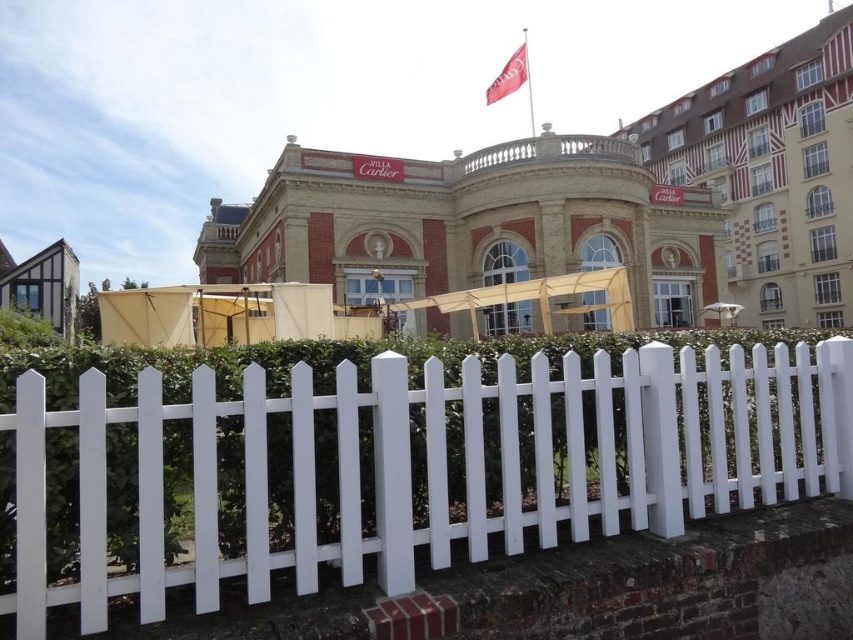
How much distance is there between white picket fence at center and red brick building at upper right?

They are 37.63 meters apart.

Who is positioned more to the left, white picket fence at center or red brick building at upper right?

white picket fence at center

Where is `white picket fence at center`? The image size is (853, 640). white picket fence at center is located at coordinates coord(419,465).

Image resolution: width=853 pixels, height=640 pixels. Identify the location of white picket fence at center. (419, 465).

Is the position of red brick building at center more distant than that of red brick building at upper right?

No, red brick building at center is closer to the viewer.

Locate an element on the screen. Image resolution: width=853 pixels, height=640 pixels. red brick building at center is located at coordinates (471, 225).

This screenshot has height=640, width=853. I want to click on red brick building at center, so click(471, 225).

Does white picket fence at center have a smaller size compared to red brick building at center?

Indeed, white picket fence at center has a smaller size compared to red brick building at center.

Does point (659, 444) come behind point (309, 262)?

No, it is in front of (309, 262).

I want to click on white picket fence at center, so click(x=419, y=465).